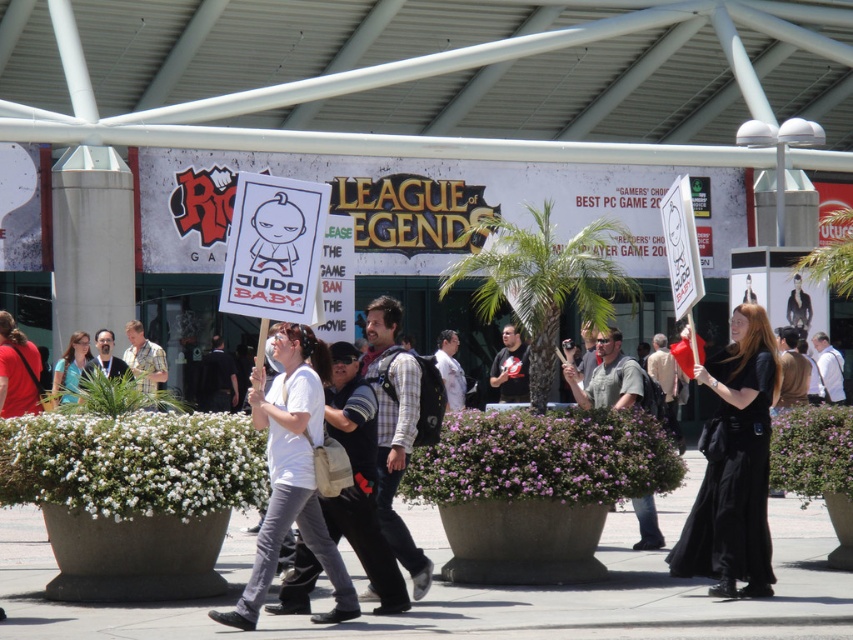
Question: Which point is farther from the camera taking this photo?

Choices:
 (A) (142, 342)
 (B) (113, 376)
 (C) (379, 332)

Answer: (A)

Question: Observing the image, what is the correct spatial positioning of gray fabric shirt at center in reference to matte black shirt at center?

Choices:
 (A) below
 (B) above

Answer: (B)

Question: Is the position of gray concrete pavement at lower center less distant than that of plaid shirt at center?

Choices:
 (A) no
 (B) yes

Answer: (B)

Question: Which of these objects is positioned closest to the white cotton shirt at center?

Choices:
 (A) gray concrete pavement at lower center
 (B) dark gray backpack at center

Answer: (B)

Question: Among these points, which one is farthest from the camera?

Choices:
 (A) (100, 337)
 (B) (627, 401)
 (C) (457, 371)

Answer: (A)

Question: Is dark gray backpack at center bigger than white fabric shirt at center?

Choices:
 (A) no
 (B) yes

Answer: (A)